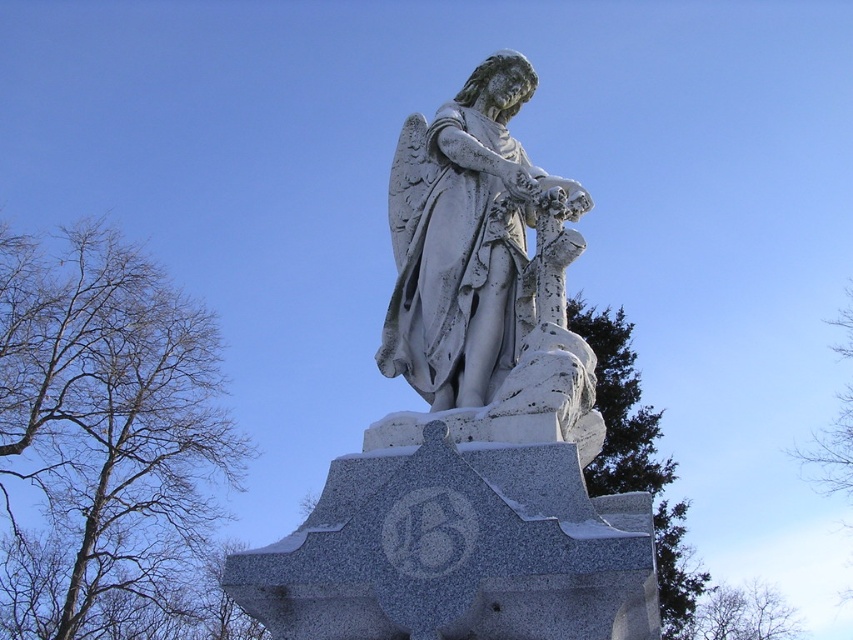
You are an art student analyzing the composition of the statue scene. Based on the spatial relationship between the white stone statue at center and the green leafless branches at upper right, which object appears narrower in the image?

The white stone statue at center appears narrower than the green leafless branches at upper right.

You are standing in front of the statue and want to take a photo that includes both the white stone statue at center and the green leafless branches at upper right. Which object should you position closer to the camera to ensure both are in focus?

To ensure both the white stone statue at center and the green leafless branches at upper right are in focus, position the camera closer to the white stone statue at center since it is nearer to the viewer compared to the green leafless branches at upper right.